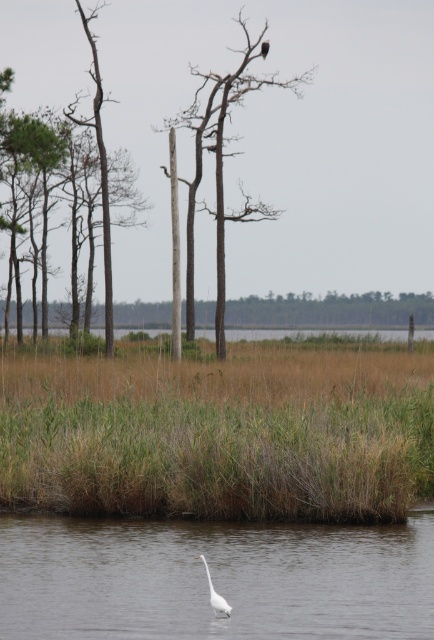
You are standing at the edge of the wetland scene. You see the white smooth water at lower center and the brown wood tree at center. Which object is positioned to the right of the other?

The white smooth water at lower center is to the right of the brown wood tree at center.

You are a drone operator trying to capture a photo of the white smooth water at lower center. The drone has a camera with a 100mm lens. The drone is currently positioned at point A, which is at coordinates 0.800, 0.500. To ensure the water is in the center of the photo, should you move the drone north or south? Please explain your reasoning.

The white smooth water at lower center is located at point (213, 579). The drone is at (217, 512). The y coordinate of the water is 0.493, which is slightly south of the drone position at 0.500. To center the water, the drone should move slightly south to align with the water at 0.493.